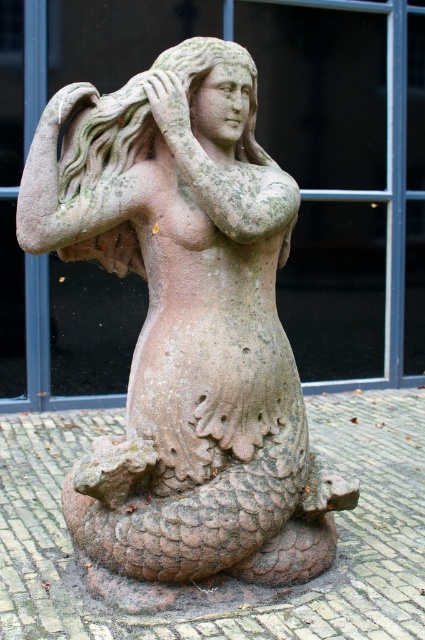
The image size is (425, 640). I want to click on green stone head at center, so click(x=206, y=74).

Does point (252, 102) come behind point (170, 100)?

Yes, it is.

Identify the location of green stone head at center. The width and height of the screenshot is (425, 640). (206, 74).

Does green mossy stone mermaid at center have a smaller size compared to green stone head at center?

No.

Is green mossy stone mermaid at center positioned at the back of green stone head at center?

No.

Between point (144, 131) and point (189, 65), which one is positioned in front?

Point (189, 65) is more forward.

Locate an element on the screen. Image resolution: width=425 pixels, height=640 pixels. green mossy stone mermaid at center is located at coordinates [x=187, y=330].

Is green mossy stone mermaid at center wider than matte stone hand at upper center?

Yes, green mossy stone mermaid at center is wider than matte stone hand at upper center.

Which is behind, point (201, 390) or point (152, 83)?

The point (201, 390) is behind.

The image size is (425, 640). In order to click on green mossy stone mermaid at center in this screenshot , I will do [x=187, y=330].